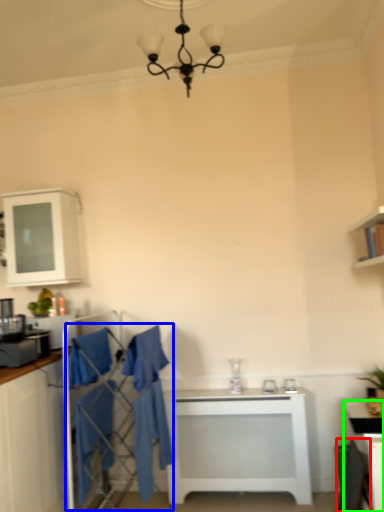
Question: Which object is positioned farthest from chair (highlighted by a red box)? Select from swivel chair (highlighted by a blue box) and table (highlighted by a green box).

Choices:
 (A) swivel chair
 (B) table

Answer: (A)